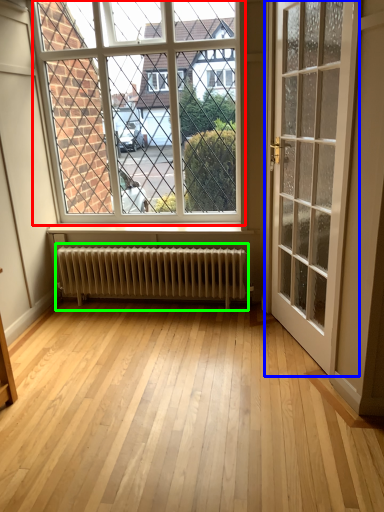
Question: Which is farther away from window (highlighted by a red box)? door (highlighted by a blue box) or radiator (highlighted by a green box)?

Choices:
 (A) door
 (B) radiator

Answer: (A)